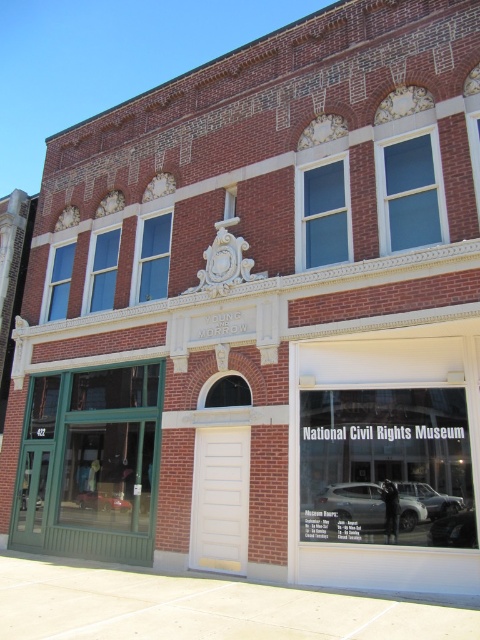
Is satin silver car at center bigger than metallic red car at lower left?

Yes.

Describe the element at coordinates (367, 508) in the screenshot. I see `satin silver car at center` at that location.

You are a GUI agent. You are given a task and a screenshot of the screen. Output one action in this format:
    pyautogui.click(x=<x>, y=<y>)
    Task: Click on the satin silver car at center
    
    Given the screenshot: What is the action you would take?
    pyautogui.click(x=367, y=508)

Which is above, metallic silver car at lower right or metallic red car at lower left?

metallic silver car at lower right is above.

Does metallic silver car at lower right come behind metallic red car at lower left?

No, metallic silver car at lower right is closer to the viewer.

Locate an element on the screen. Image resolution: width=480 pixels, height=640 pixels. metallic silver car at lower right is located at coordinates (455, 529).

Does satin silver suv at lower right have a larger size compared to metallic red car at lower left?

No, satin silver suv at lower right is not bigger than metallic red car at lower left.

Which of these two, satin silver suv at lower right or metallic red car at lower left, stands shorter?

metallic red car at lower left is shorter.

Between point (440, 508) and point (76, 493), which one is positioned behind?

The point (76, 493) is behind.

This screenshot has width=480, height=640. Identify the location of satin silver suv at lower right. (430, 499).